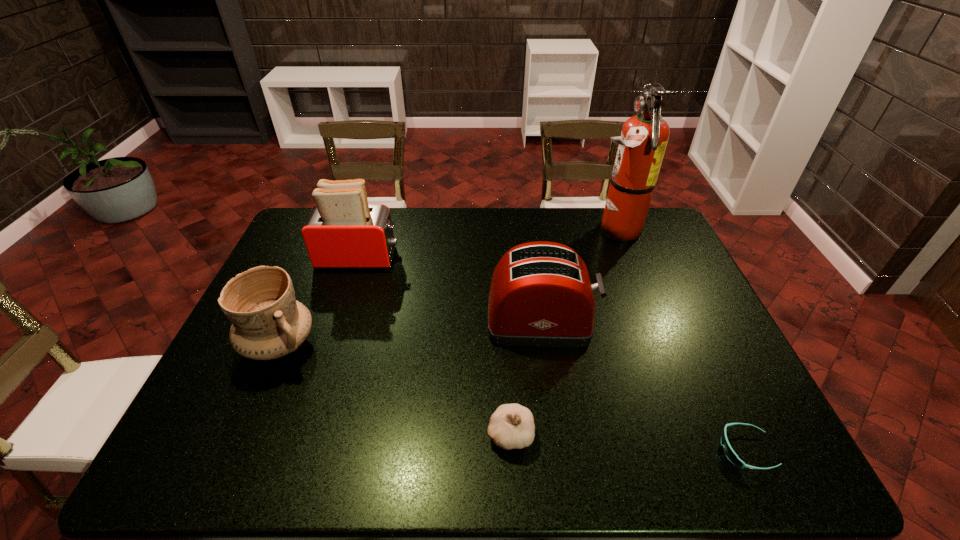
This screenshot has height=540, width=960. In order to click on vacant space positioned 0.400m from the nozzle of the tallest object in this screenshot , I will do `click(477, 230)`.

Identify the location of free space located on the front-facing side of the taller toaster. (471, 258).

Locate an element on the screen. free space located 0.220m on the front of the nearer toaster is located at coordinates (555, 422).

Where is `free space located on the back of the pottery`? free space located on the back of the pottery is located at coordinates (322, 245).

The width and height of the screenshot is (960, 540). I want to click on free space located 0.080m on the back of the second shortest object, so click(x=507, y=384).

Find the location of a particular element. free space located on the front-facing side of the sunglasses is located at coordinates point(540,450).

Where is `vacant space located 0.230m on the front-facing side of the sunglasses`? vacant space located 0.230m on the front-facing side of the sunglasses is located at coordinates point(616,450).

Identify the location of free space located 0.200m on the front-facing side of the sunglasses. (630, 450).

At what (x,y) coordinates should I click in order to perform the action: click on fire extinguisher present at the far edge. Please return your answer as a coordinate pair (x, y). Looking at the image, I should click on (644, 137).

Find the location of `toaster situated at the far edge`. toaster situated at the far edge is located at coordinates (342, 231).